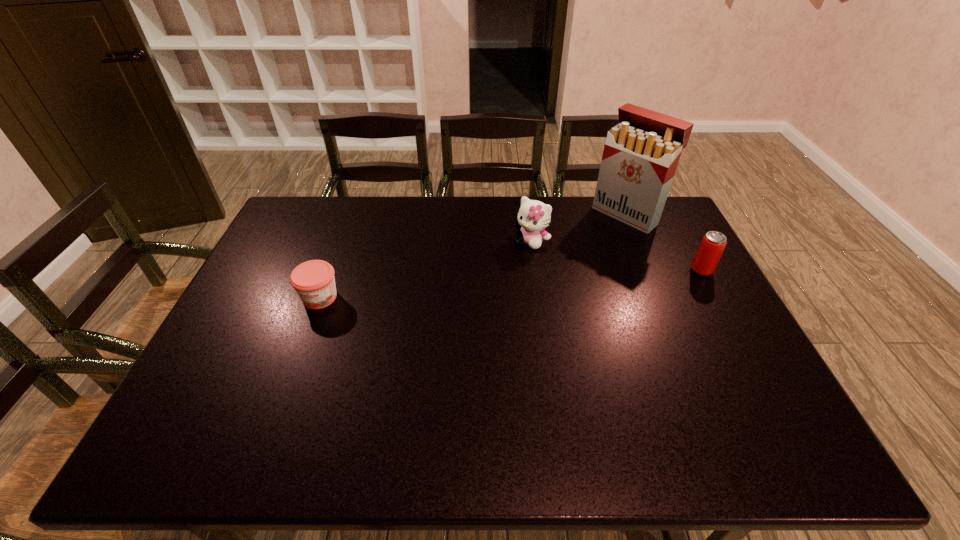
Locate an element on the screen. Image resolution: width=960 pixels, height=540 pixels. the leftmost object is located at coordinates (314, 281).

Identify the location of jam. (314, 281).

The height and width of the screenshot is (540, 960). I want to click on the rightmost object, so click(710, 250).

This screenshot has width=960, height=540. In order to click on beer can in this screenshot , I will do `click(710, 250)`.

At what (x,y) coordinates should I click in order to perform the action: click on the third shortest object. Please return your answer as a coordinate pair (x, y). The width and height of the screenshot is (960, 540). Looking at the image, I should click on (534, 216).

You are a GUI agent. You are given a task and a screenshot of the screen. Output one action in this format:
    pyautogui.click(x=<x>, y=<y>)
    Task: Click on the kitten
    The height and width of the screenshot is (540, 960).
    Given the screenshot: What is the action you would take?
    pyautogui.click(x=534, y=216)

This screenshot has height=540, width=960. What are the coordinates of `cigarette case` in the screenshot? It's located at (641, 154).

Find the location of a particular element. The height and width of the screenshot is (540, 960). the tallest object is located at coordinates point(641,154).

Identify the location of vacant area situated on the front label of the leftmost object. The image size is (960, 540). (292, 372).

Where is `vacant space located 0.110m on the back of the rightmost object`? vacant space located 0.110m on the back of the rightmost object is located at coordinates (685, 241).